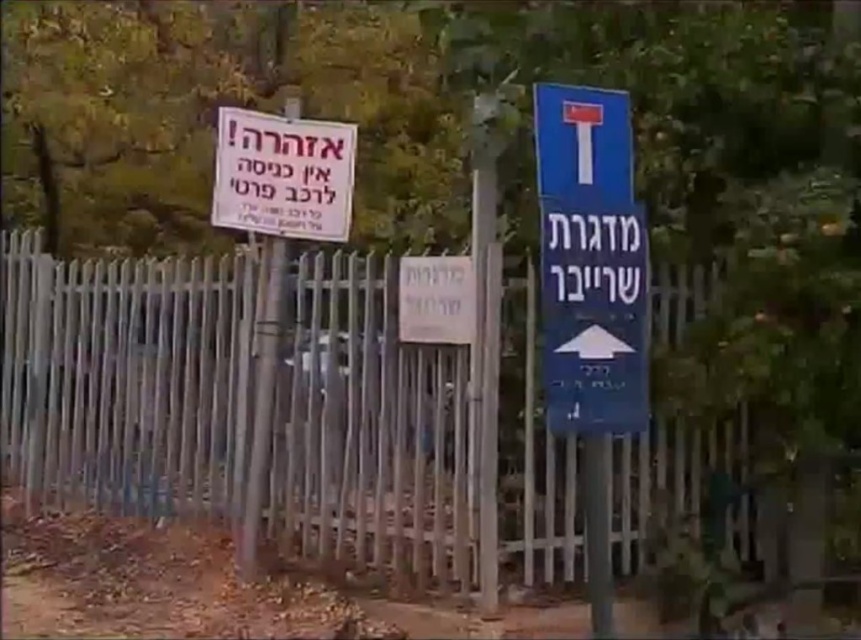
Looking at this image, who is taller, silver metallic fence at center or white paper sign at upper left?

With more height is silver metallic fence at center.

Which is behind, point (409, 435) or point (300, 145)?

The point (300, 145) is behind.

Measure the distance between silver metallic fence at center and camera.

silver metallic fence at center is 2.73 meters from camera.

Where is `silver metallic fence at center`? The height and width of the screenshot is (640, 861). silver metallic fence at center is located at coordinates (406, 444).

Between silver metallic fence at center and blue plastic sign at right, which one appears on the left side from the viewer's perspective?

silver metallic fence at center is more to the left.

Is silver metallic fence at center above blue plastic sign at right?

Actually, silver metallic fence at center is below blue plastic sign at right.

Between point (339, 340) and point (618, 147), which one is positioned behind?

Point (339, 340)

Identify the location of silver metallic fence at center. Image resolution: width=861 pixels, height=640 pixels. (406, 444).

Is blue plastic sign at right taller than white paper sign at upper left?

Yes, blue plastic sign at right is taller than white paper sign at upper left.

Which is above, blue plastic sign at right or white paper sign at upper left?

white paper sign at upper left is higher up.

The width and height of the screenshot is (861, 640). I want to click on blue plastic sign at right, so click(x=590, y=260).

Identify the location of blue plastic sign at right. (590, 260).